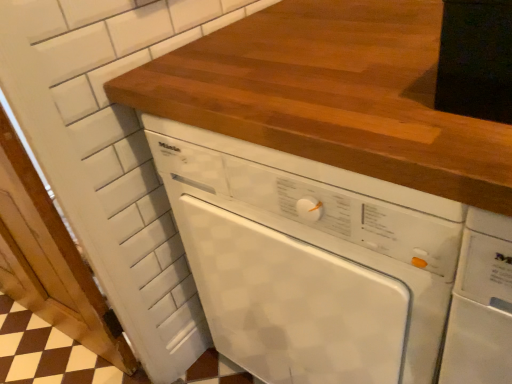
Question: From a real-world perspective, is white glossy dishwasher at center physically below wooden countertop at center?

Choices:
 (A) no
 (B) yes

Answer: (B)

Question: Does white glossy dishwasher at center turn towards wooden countertop at center?

Choices:
 (A) yes
 (B) no

Answer: (B)

Question: Is white glossy dishwasher at center wider than wooden countertop at center?

Choices:
 (A) yes
 (B) no

Answer: (A)

Question: Is the position of white glossy dishwasher at center less distant than that of wooden countertop at center?

Choices:
 (A) no
 (B) yes

Answer: (A)

Question: Can you confirm if white glossy dishwasher at center is smaller than wooden countertop at center?

Choices:
 (A) no
 (B) yes

Answer: (A)

Question: Considering the relative sizes of white glossy dishwasher at center and wooden countertop at center in the image provided, is white glossy dishwasher at center taller than wooden countertop at center?

Choices:
 (A) no
 (B) yes

Answer: (B)

Question: Does white painted wood door at left have a greater width compared to white glossy dishwasher at center?

Choices:
 (A) yes
 (B) no

Answer: (B)

Question: Is white glossy dishwasher at center a part of white painted wood door at left?

Choices:
 (A) no
 (B) yes

Answer: (A)

Question: Is white painted wood door at left positioned beyond the bounds of white glossy dishwasher at center?

Choices:
 (A) no
 (B) yes

Answer: (B)

Question: Does white painted wood door at left have a smaller size compared to white glossy dishwasher at center?

Choices:
 (A) yes
 (B) no

Answer: (A)

Question: From a real-world perspective, is white painted wood door at left under white glossy dishwasher at center?

Choices:
 (A) no
 (B) yes

Answer: (A)

Question: Considering the relative sizes of white painted wood door at left and white glossy dishwasher at center in the image provided, is white painted wood door at left bigger than white glossy dishwasher at center?

Choices:
 (A) no
 (B) yes

Answer: (A)

Question: Could you tell me if white painted wood door at left is facing wooden countertop at center?

Choices:
 (A) no
 (B) yes

Answer: (A)